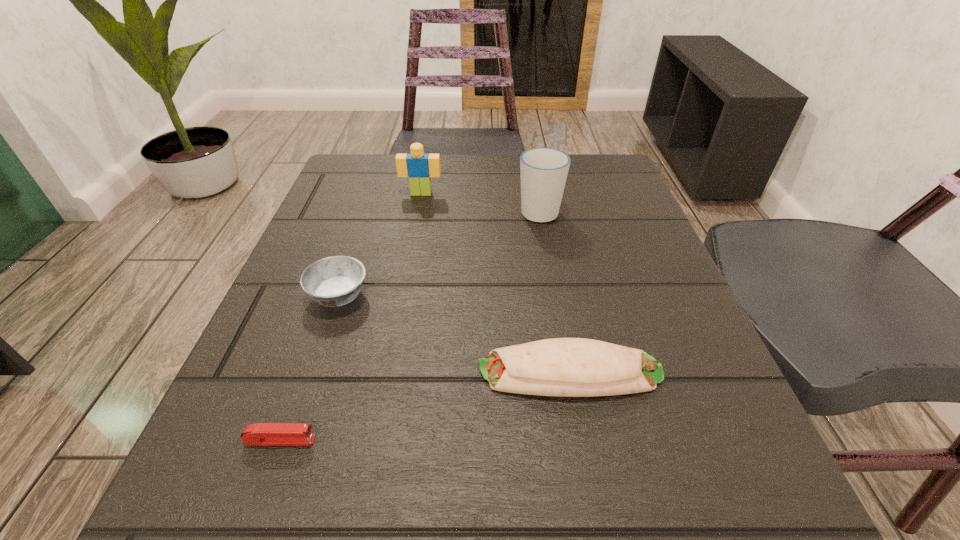
Locate an element on the screen. The width and height of the screenshot is (960, 540). cup is located at coordinates coord(543,170).

You are a GUI agent. You are given a task and a screenshot of the screen. Output one action in this format:
    pyautogui.click(x=<x>, y=<y>)
    Task: Click on the Lego
    The width and height of the screenshot is (960, 540).
    Given the screenshot: What is the action you would take?
    pyautogui.click(x=419, y=167)

Where is `the third tallest object`? the third tallest object is located at coordinates (334, 281).

Find the location of a particular element. The image size is (960, 540). the third farthest object is located at coordinates (334, 281).

At what (x,y) coordinates should I click in order to perform the action: click on the fourth farthest object. Please return your answer as a coordinate pair (x, y). Looking at the image, I should click on (569, 367).

You are a GUI agent. You are given a task and a screenshot of the screen. Output one action in this format:
    pyautogui.click(x=<x>, y=<y>)
    Task: Click on the second shortest object
    
    Given the screenshot: What is the action you would take?
    pyautogui.click(x=569, y=367)

The height and width of the screenshot is (540, 960). What are the coordinates of `the shortest object` in the screenshot? It's located at (262, 434).

Locate an element on the screen. The height and width of the screenshot is (540, 960). stapler is located at coordinates (262, 434).

Identify the location of vacant area situated with a handle on the side of the cup. (533, 176).

Where is `free region located with a handle on the side of the cup`? free region located with a handle on the side of the cup is located at coordinates (535, 185).